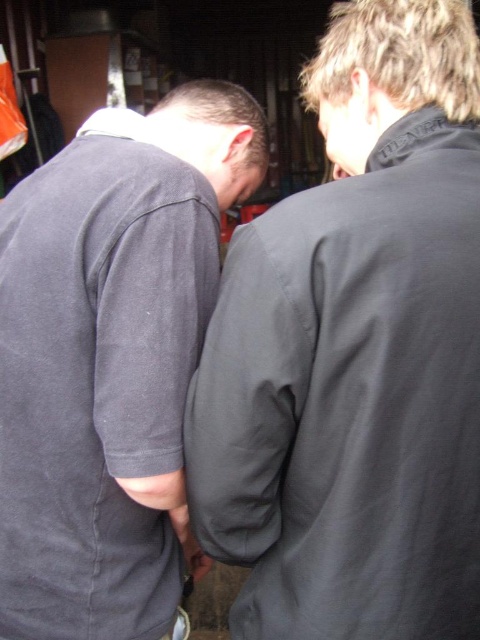
From the picture: Can you confirm if dark gray fabric at center is shorter than dark gray cotton shirt at center?

Incorrect, dark gray fabric at center's height does not fall short of dark gray cotton shirt at center's.

Is dark gray fabric at center thinner than dark gray cotton shirt at center?

In fact, dark gray fabric at center might be wider than dark gray cotton shirt at center.

What are the coordinates of `dark gray fabric at center` in the screenshot? It's located at (356, 353).

This screenshot has width=480, height=640. What are the coordinates of `dark gray fabric at center` in the screenshot? It's located at (356, 353).